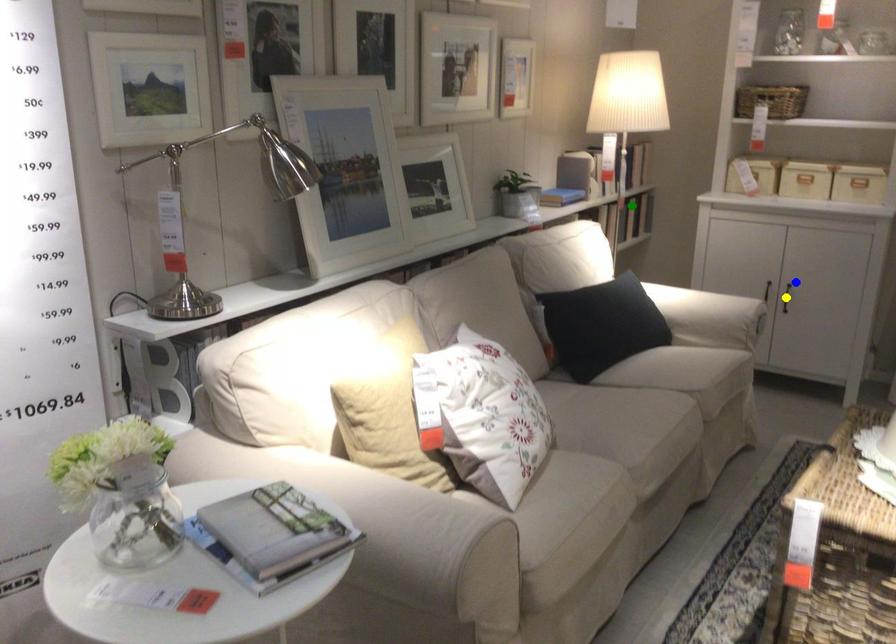
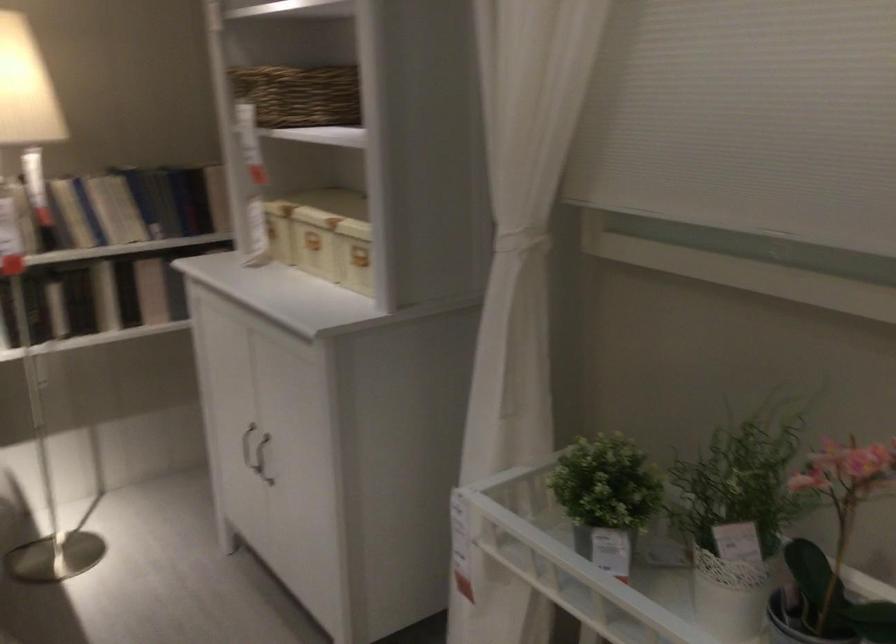
I am providing you with two images of the same scene from different viewpoints. Three points are marked in image1. Which point corresponds to a part or object that is occluded in image2?In image1, three points are marked. Which of them correspond to a part or object that is occluded in image2?Among the three points shown in image1, which one corresponds to a part or object that is no longer visible due to occlusion in image2?

yellow point